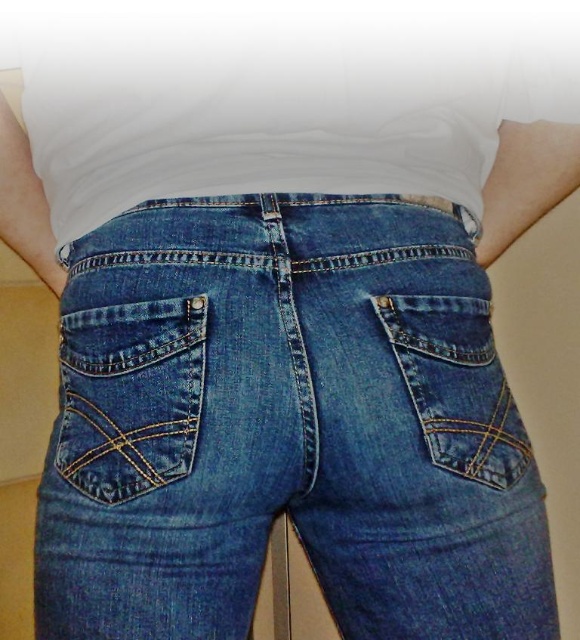
Is point (349, 42) positioned in front of point (95, 419)?

No, (349, 42) is further to viewer.

You are a GUI agent. You are given a task and a screenshot of the screen. Output one action in this format:
    pyautogui.click(x=<x>, y=<y>)
    Task: Click on the white matte shirt at center
    This screenshot has width=580, height=640.
    Given the screenshot: What is the action you would take?
    pyautogui.click(x=284, y=104)

Is denim blue jeans at center wider than white matte shirt at center?

In fact, denim blue jeans at center might be narrower than white matte shirt at center.

What do you see at coordinates (285, 426) in the screenshot? The width and height of the screenshot is (580, 640). I see `denim blue jeans at center` at bounding box center [285, 426].

Measure the distance between denim blue jeans at center and camera.

denim blue jeans at center is 20.01 inches away from camera.

Where is `denim blue jeans at center`? denim blue jeans at center is located at coordinates (285, 426).

Consider the image. Who is positioned more to the left, white matte shirt at center or denim pocket at center-right?

white matte shirt at center is more to the left.

Between white matte shirt at center and denim pocket at center-right, which one has less height?

denim pocket at center-right

Who is more forward, (205, 100) or (501, 460)?

Positioned in front is point (501, 460).

Locate an element on the screen. The width and height of the screenshot is (580, 640). white matte shirt at center is located at coordinates pyautogui.click(x=284, y=104).